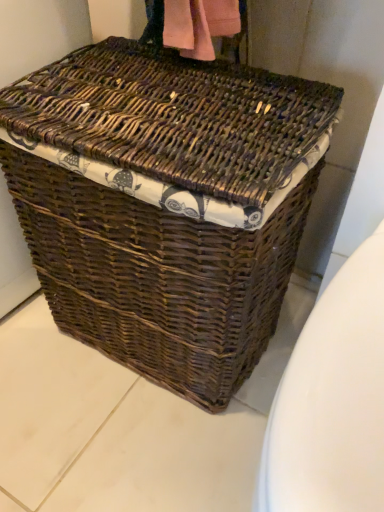
Question: Should I look upward or downward to see brown wicker picnic basket at center?

Choices:
 (A) up
 (B) down

Answer: (A)

Question: Can you confirm if white glossy toilet bowl at lower right is thinner than brown wicker picnic basket at center?

Choices:
 (A) no
 (B) yes

Answer: (A)

Question: Considering the relative positions of white glossy toilet bowl at lower right and brown wicker picnic basket at center in the image provided, is white glossy toilet bowl at lower right to the left of brown wicker picnic basket at center from the viewer's perspective?

Choices:
 (A) yes
 (B) no

Answer: (B)

Question: Does white glossy toilet bowl at lower right appear on the right side of brown wicker picnic basket at center?

Choices:
 (A) no
 (B) yes

Answer: (B)

Question: Is white glossy toilet bowl at lower right looking in the opposite direction of brown wicker picnic basket at center?

Choices:
 (A) no
 (B) yes

Answer: (A)

Question: Does white glossy toilet bowl at lower right have a greater width compared to brown wicker picnic basket at center?

Choices:
 (A) yes
 (B) no

Answer: (A)

Question: From a real-world perspective, is white glossy toilet bowl at lower right positioned under brown wicker picnic basket at center based on gravity?

Choices:
 (A) no
 (B) yes

Answer: (B)

Question: Is brown wicker picnic basket at center to the left of white glossy toilet bowl at lower right from the viewer's perspective?

Choices:
 (A) no
 (B) yes

Answer: (B)

Question: From the image's perspective, is brown wicker picnic basket at center below white glossy toilet bowl at lower right?

Choices:
 (A) yes
 (B) no

Answer: (B)

Question: Is brown wicker picnic basket at center facing away from white glossy toilet bowl at lower right?

Choices:
 (A) no
 (B) yes

Answer: (A)

Question: Is brown wicker picnic basket at center behind white glossy toilet bowl at lower right?

Choices:
 (A) yes
 (B) no

Answer: (A)

Question: Is brown wicker picnic basket at center taller than white glossy toilet bowl at lower right?

Choices:
 (A) no
 (B) yes

Answer: (B)

Question: Can you confirm if brown wicker picnic basket at center is shorter than white glossy toilet bowl at lower right?

Choices:
 (A) no
 (B) yes

Answer: (A)

Question: Does point (283, 490) appear closer or farther from the camera than point (279, 203)?

Choices:
 (A) farther
 (B) closer

Answer: (B)